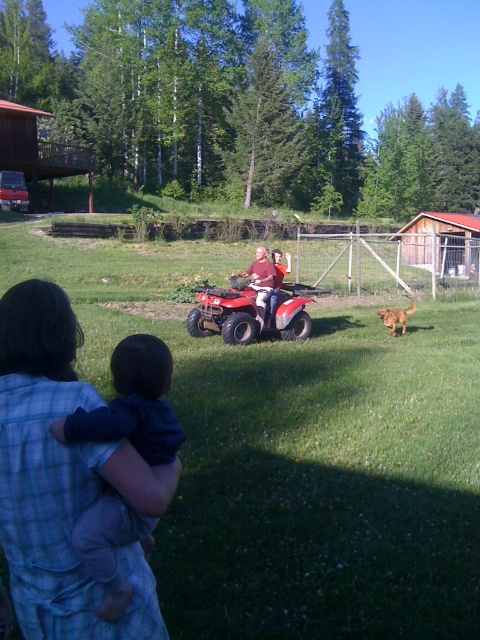
Question: Does green grass at center have a larger size compared to matte red quad bike at center?

Choices:
 (A) yes
 (B) no

Answer: (A)

Question: Does matte red quad bike at center have a larger size compared to golden fur dog at right?

Choices:
 (A) yes
 (B) no

Answer: (A)

Question: Among these points, which one is farthest from the camera?

Choices:
 (A) (265, 253)
 (B) (402, 564)
 (C) (144, 452)
 (D) (410, 305)

Answer: (D)

Question: Based on their relative distances, which object is farther from the matte red quad bike at center?

Choices:
 (A) golden fur dog at right
 (B) green grass at center

Answer: (B)

Question: Which point appears farthest from the camera in this image?

Choices:
 (A) (254, 273)
 (B) (164, 412)

Answer: (A)

Question: In this image, where is dark blue fabric baby at lower left located relative to matte red quad bike at center?

Choices:
 (A) left
 (B) right

Answer: (B)